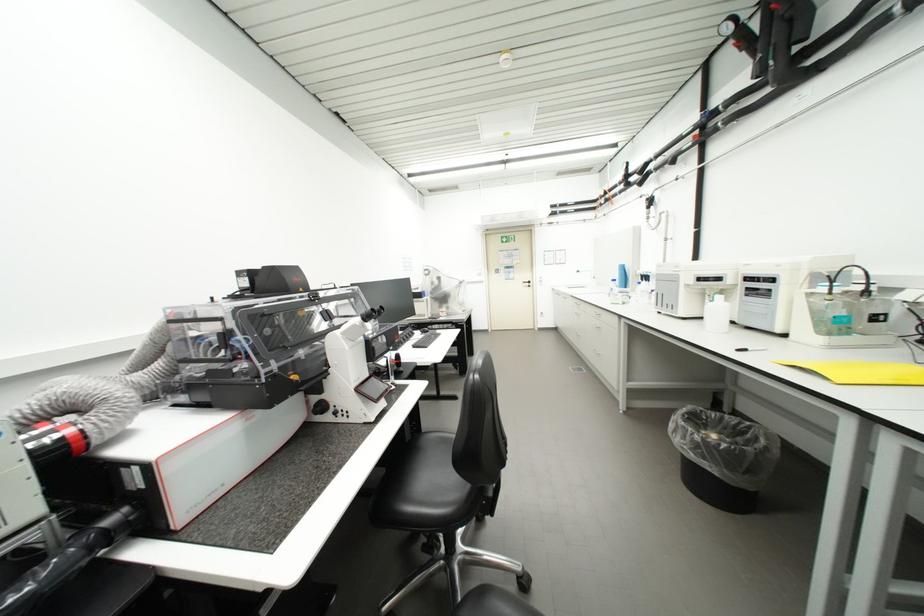
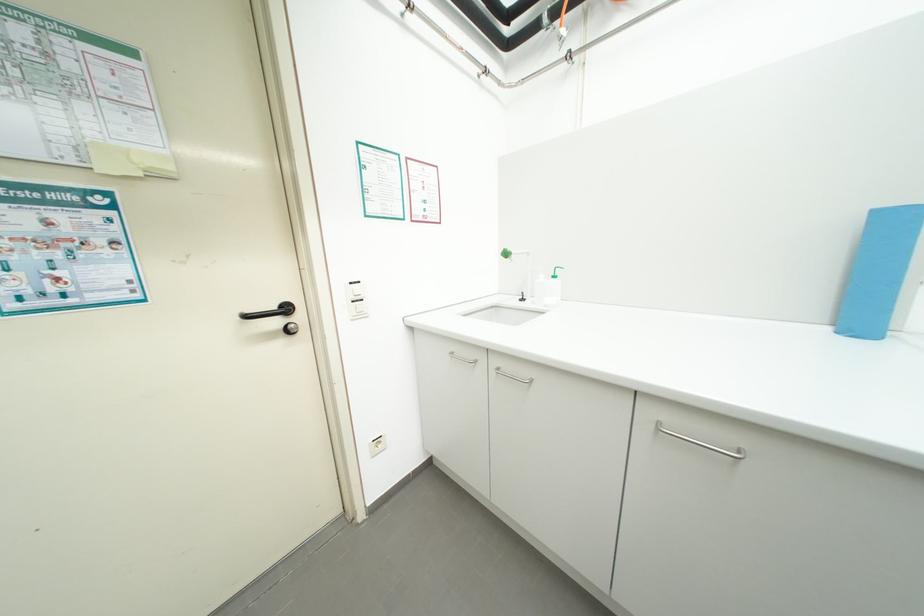
Where in the second image is the point corresponding to pixel 535 285 from the first image?

(285, 323)